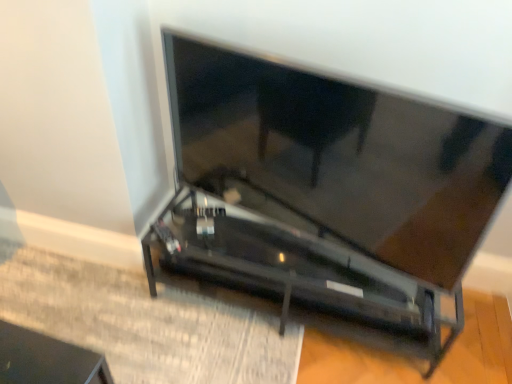
What do you see at coordinates (324, 197) in the screenshot? I see `black glossy table at center` at bounding box center [324, 197].

Where is `black glossy table at center`? black glossy table at center is located at coordinates (324, 197).

Locate an element on the screen. black glossy table at center is located at coordinates (324, 197).